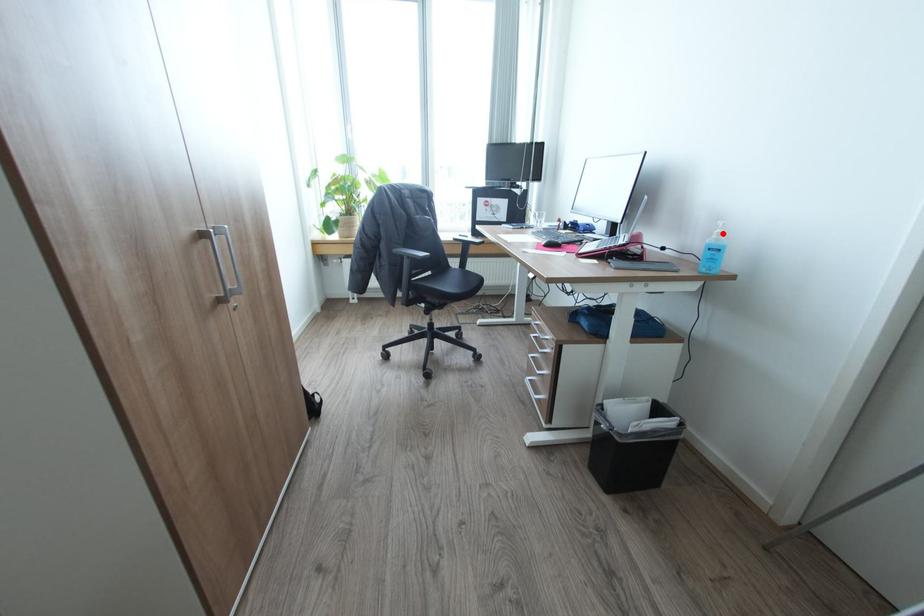
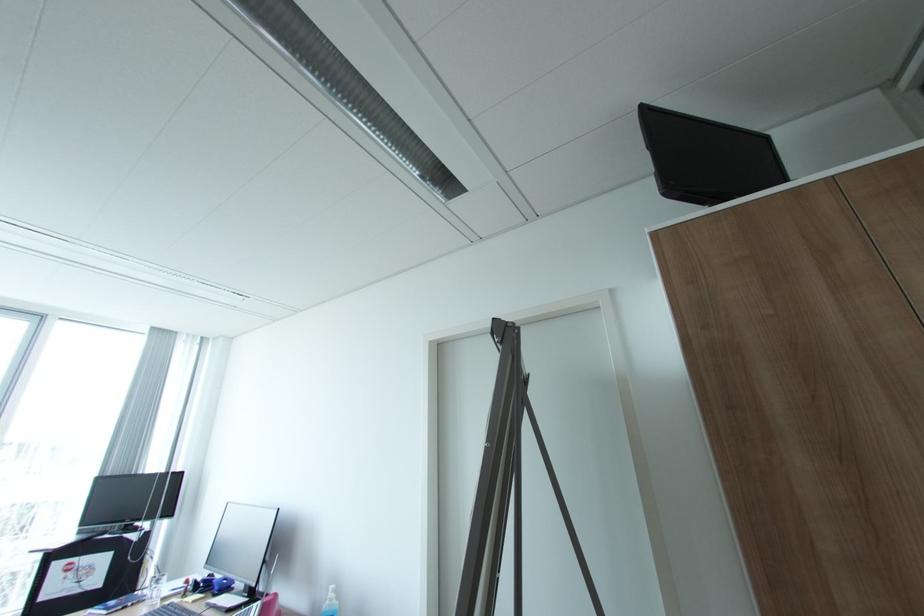
The point at the highlighted location is marked in the first image. Where is the corresponding point in the second image?

(336, 599)